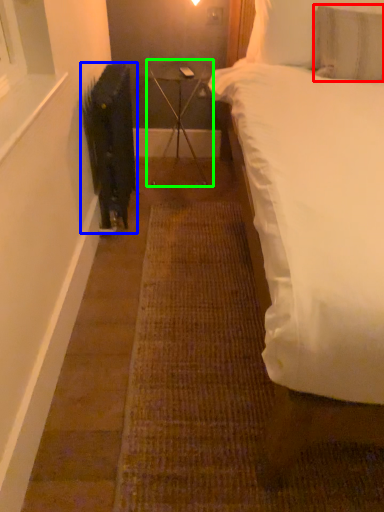
Question: Estimate the real-world distances between objects in this image. Which object is farther from pillow (highlighted by a red box), radiator (highlighted by a blue box) or table (highlighted by a green box)?

Choices:
 (A) radiator
 (B) table

Answer: (A)